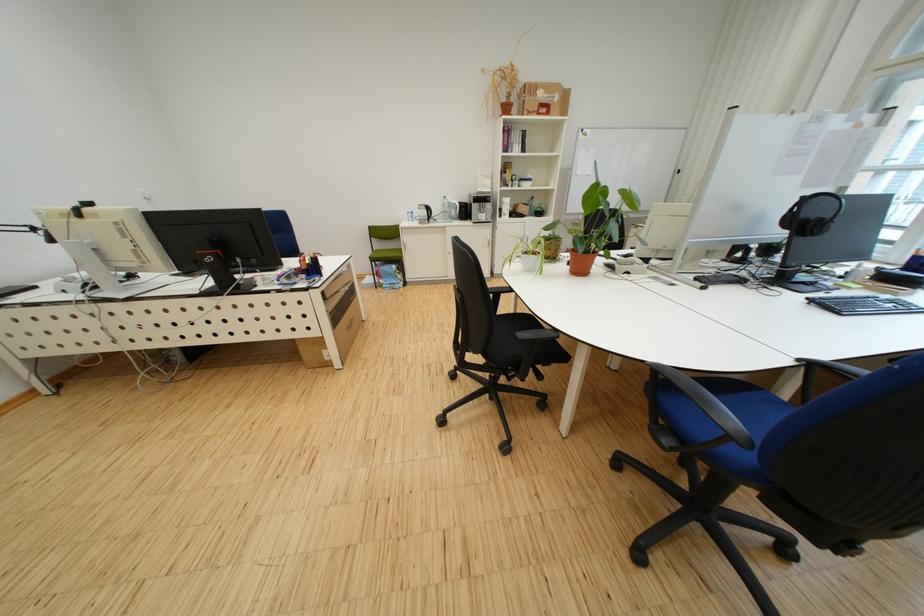
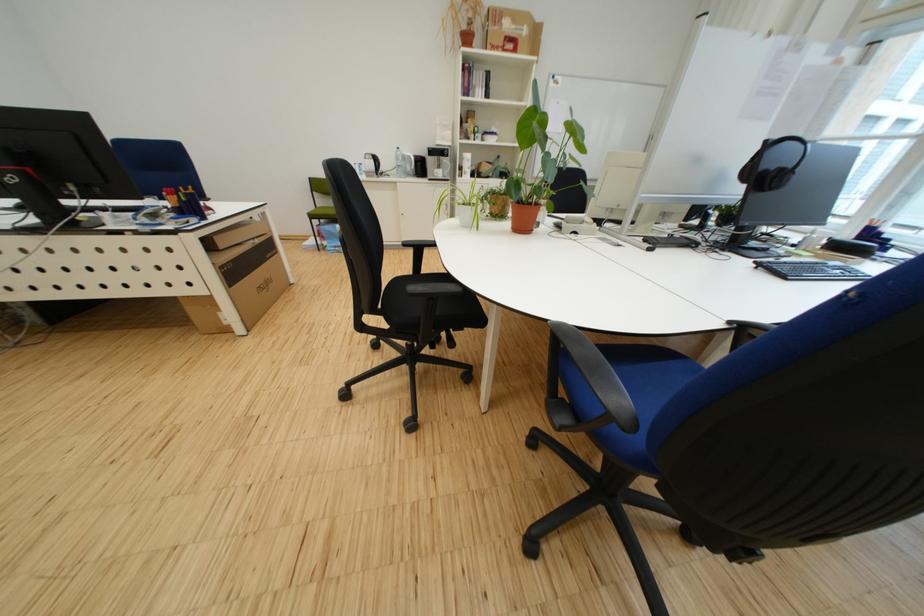
What movement of the cameraman would produce the second image?

The cameraman walked toward right, forward.